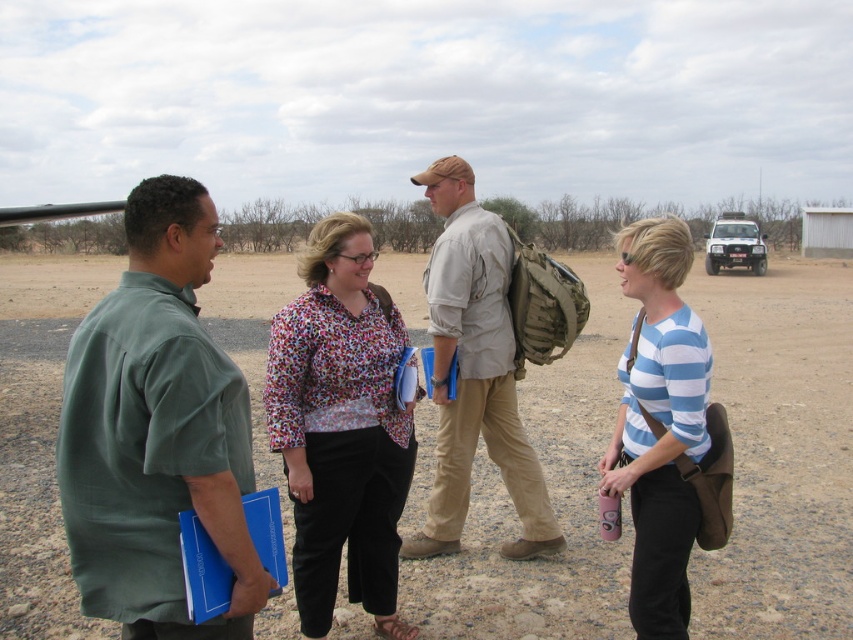
What is the location of the point with coordinates [781,451] in the image?

The point with coordinates [781,451] is located on the dirt field at center.

You are standing in the savanna landscape and see two points marked in the image. Which point is closer to you, point (x=614, y=289) or point (x=218, y=368)?

Point (x=614, y=289) is further to the viewer than point (x=218, y=368), so the closer point is point (x=218, y=368).